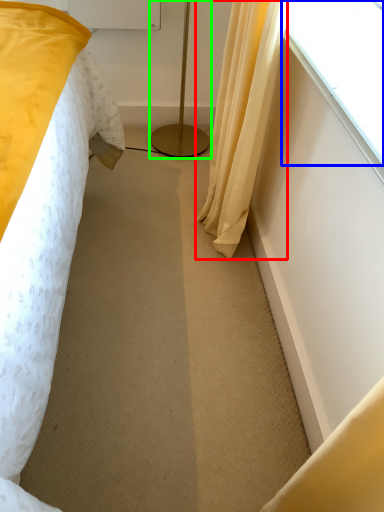
Question: Estimate the real-world distances between objects in this image. Which object is closer to curtain (highlighted by a red box), window (highlighted by a blue box) or lamp (highlighted by a green box)?

Choices:
 (A) window
 (B) lamp

Answer: (A)